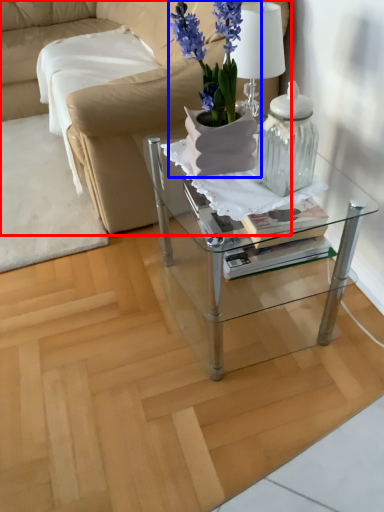
Question: Which point is closer to the camera, studio couch (highlighted by a red box) or houseplant (highlighted by a blue box)?

Choices:
 (A) studio couch
 (B) houseplant

Answer: (B)